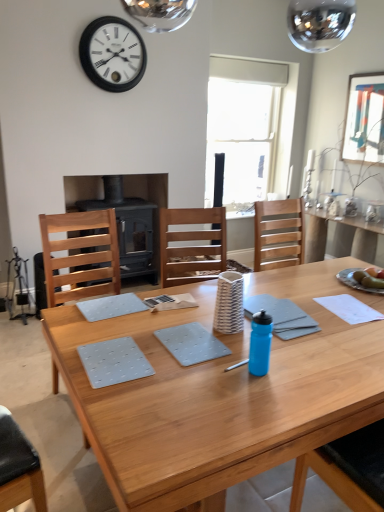
Question: Does transparent glass window at center have a smaller size compared to light wood chair at left?

Choices:
 (A) no
 (B) yes

Answer: (A)

Question: Considering the relative positions of transparent glass window at center and light wood chair at left in the image provided, is transparent glass window at center to the left of light wood chair at left from the viewer's perspective?

Choices:
 (A) no
 (B) yes

Answer: (A)

Question: Is transparent glass window at center not near light wood chair at left?

Choices:
 (A) no
 (B) yes

Answer: (B)

Question: Is transparent glass window at center further to camera compared to light wood chair at left?

Choices:
 (A) no
 (B) yes

Answer: (B)

Question: Is transparent glass window at center facing away from light wood chair at left?

Choices:
 (A) no
 (B) yes

Answer: (A)

Question: From a real-world perspective, does transparent glass window at center sit lower than light wood chair at left?

Choices:
 (A) yes
 (B) no

Answer: (B)

Question: Is matte white picture frame at upper right closer to the viewer compared to white matte wall clock at upper center?

Choices:
 (A) yes
 (B) no

Answer: (B)

Question: Is matte white picture frame at upper right thinner than white matte wall clock at upper center?

Choices:
 (A) yes
 (B) no

Answer: (A)

Question: Does matte white picture frame at upper right come behind white matte wall clock at upper center?

Choices:
 (A) yes
 (B) no

Answer: (A)

Question: Does matte white picture frame at upper right have a larger size compared to white matte wall clock at upper center?

Choices:
 (A) yes
 (B) no

Answer: (B)

Question: Are matte white picture frame at upper right and white matte wall clock at upper center making contact?

Choices:
 (A) no
 (B) yes

Answer: (A)

Question: Could you tell me if matte white picture frame at upper right is facing white matte wall clock at upper center?

Choices:
 (A) no
 (B) yes

Answer: (B)

Question: Does wooden table at center have a greater width compared to white matte wall clock at upper center?

Choices:
 (A) no
 (B) yes

Answer: (B)